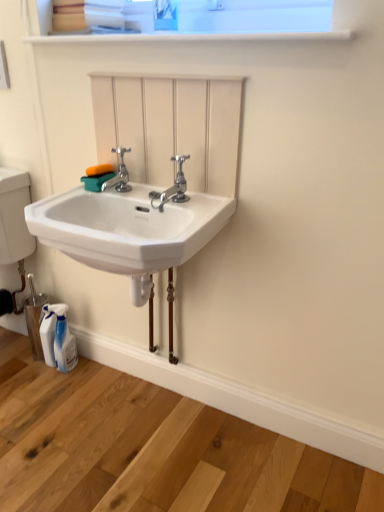
Where is `vacant area that is in front of white glossy spray bottle at lower left`? vacant area that is in front of white glossy spray bottle at lower left is located at coordinates (53, 398).